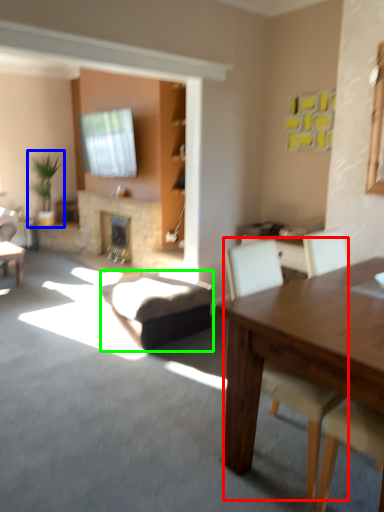
Question: Based on their relative distances, which object is nearer to chair (highlighted by a red box)? Choose from houseplant (highlighted by a blue box) and swivel chair (highlighted by a green box).

Choices:
 (A) houseplant
 (B) swivel chair

Answer: (B)